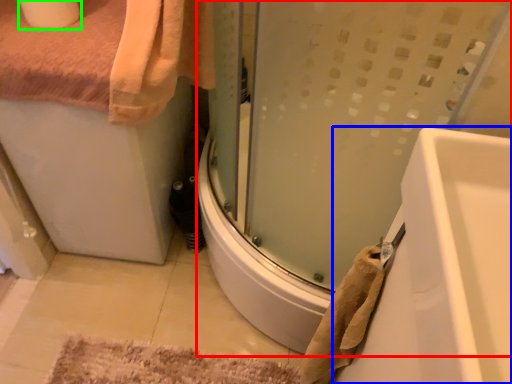
Question: Estimate the real-world distances between objects in this image. Which object is farther from shower door (highlighted by a red box), bathtub (highlighted by a blue box) or toilet paper (highlighted by a green box)?

Choices:
 (A) bathtub
 (B) toilet paper

Answer: (B)